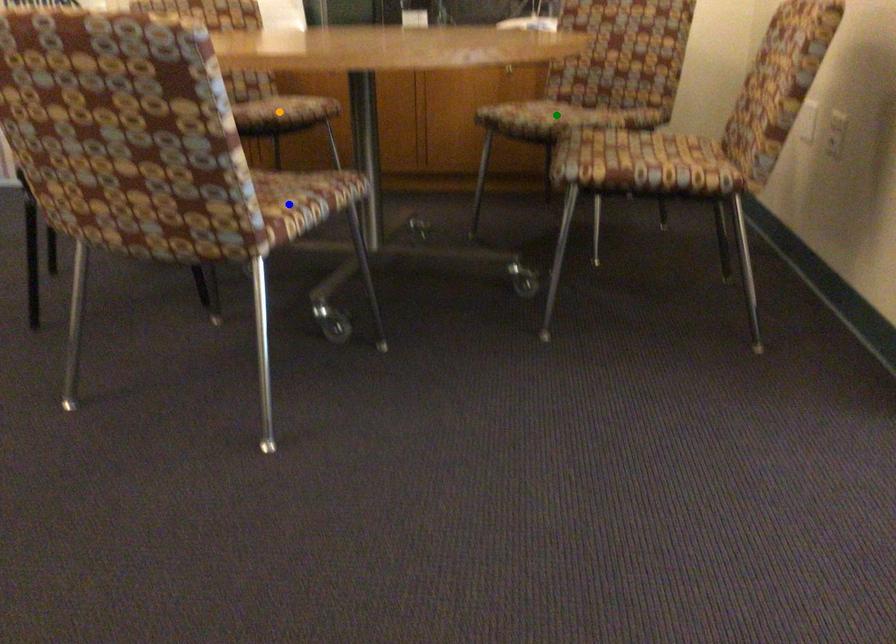
Order these from farthest to nearest:
1. orange point
2. blue point
3. green point

orange point → green point → blue point